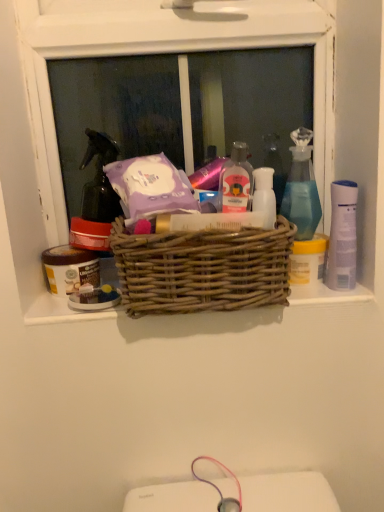
What is the approximate width of transparent glass door at upper center?

transparent glass door at upper center is 3.54 inches wide.

What is the approximate height of white plastic bottle at center, marked as the 2th toiletry in a front-to-back arrangement?

white plastic bottle at center, marked as the 2th toiletry in a front-to-back arrangement, is 9.26 centimeters tall.

Image resolution: width=384 pixels, height=512 pixels. Describe the element at coordinates (342, 236) in the screenshot. I see `white plastic mouthwash at right` at that location.

Identify the location of transparent glass door at upper center. This screenshot has width=384, height=512. (115, 111).

Considering the positions of points (143, 291) and (224, 178), is point (143, 291) closer to camera compared to point (224, 178)?

Yes.

How many degrees apart are the facing directions of woven wood basket at center and translucent plastic bottle at center, which is counted as the 3th toiletry, starting from the back?

The angular difference between woven wood basket at center and translucent plastic bottle at center, which is counted as the 3th toiletry, starting from the back, is 5.59 degrees.

Image resolution: width=384 pixels, height=512 pixels. Find the location of `picnic basket below the translucent plastic bottle at center, positioned as the second toiletry in left-to-right order (from the image's perspective)`. picnic basket below the translucent plastic bottle at center, positioned as the second toiletry in left-to-right order (from the image's perspective) is located at coordinates (202, 269).

Does woven wood basket at center have a lesser width compared to translucent plastic bottle at center, positioned as the second toiletry in left-to-right order?

No.

Which is less distant, (332, 212) or (308, 110)?

Positioned in front is point (332, 212).

From a real-world perspective, who is located higher, white plastic mouthwash at right or transparent glass door at upper center?

transparent glass door at upper center.

Is white plastic mouthwash at right far from transparent glass door at upper center?

That's right, there is a large distance between white plastic mouthwash at right and transparent glass door at upper center.

From a real-world perspective, is transparent glass door at upper center physically located above or below white plastic bottle at center, acting as the third toiletry starting from the left?

In terms of real-world spatial position, transparent glass door at upper center is above white plastic bottle at center, acting as the third toiletry starting from the left.

Identify the location of glass door above the white plastic bottle at center, acting as the third toiletry starting from the left (from the image's perspective). The height and width of the screenshot is (512, 384). (115, 111).

Is transparent glass door at upper center to the left of white plastic bottle at center, acting as the third toiletry starting from the left, from the viewer's perspective?

Yes, transparent glass door at upper center is to the left of white plastic bottle at center, acting as the third toiletry starting from the left.

Would you say white plastic bottle at center, positioned as the 2th toiletry in back-to-front order, is part of transparent glass door at upper center's contents?

No, white plastic bottle at center, positioned as the 2th toiletry in back-to-front order, is not surrounded by transparent glass door at upper center.

Would you say translucent plastic bottle at center, the first toiletry in the front-to-back sequence, is inside or outside translucent glass spray bottle at upper right?

translucent plastic bottle at center, the first toiletry in the front-to-back sequence, is not enclosed by translucent glass spray bottle at upper right.

Which of these two, translucent plastic bottle at center, which is counted as the 3th toiletry, starting from the back, or translucent glass spray bottle at upper right, is bigger?

translucent glass spray bottle at upper right is bigger.

Is translucent glass spray bottle at upper right at the back of translucent plastic bottle at center, positioned as the second toiletry in left-to-right order?

That's not correct — translucent plastic bottle at center, positioned as the second toiletry in left-to-right order, is not looking away from translucent glass spray bottle at upper right.

Is point (225, 195) positioned after point (305, 223)?

No.

Can you confirm if white plastic bottle at center, the first toiletry positioned from the right, is bigger than woven wood basket at center?

No, white plastic bottle at center, the first toiletry positioned from the right, is not bigger than woven wood basket at center.

From a real-world perspective, starting from the woven wood basket at center, which toiletry is the 1st one vertically above it? Please provide its 2D coordinates.

[(264, 195)]

How distant is white plastic bottle at center, the first toiletry positioned from the right, from woven wood basket at center?

white plastic bottle at center, the first toiletry positioned from the right, is 4.91 inches away from woven wood basket at center.

In the scene shown: How many degrees apart are the facing directions of matte brown jar at left, which is the 3th toiletry from front to back, and translucent plastic bottle at center, the first toiletry in the front-to-back sequence?

0.00737 degrees separate the facing orientations of matte brown jar at left, which is the 3th toiletry from front to back, and translucent plastic bottle at center, the first toiletry in the front-to-back sequence.

In the scene shown: From the image's perspective, relative to translucent plastic bottle at center, which is counted as the 3th toiletry, starting from the back, is matte brown jar at left, marked as the 3th toiletry in a right-to-left arrangement, above or below?

Based on their image positions, matte brown jar at left, marked as the 3th toiletry in a right-to-left arrangement, is located beneath translucent plastic bottle at center, which is counted as the 3th toiletry, starting from the back.

Is point (65, 292) farther from camera compared to point (223, 179)?

Yes.

Choose the correct answer: Is matte brown jar at left, which is the 3th toiletry from front to back, inside translucent plastic bottle at center, positioned as the second toiletry in left-to-right order, or outside it?

The correct answer is: outside.

From a real-world perspective, is woven wood basket at center positioned under white plastic mouthwash at right based on gravity?

Yes, from a real-world perspective, woven wood basket at center is beneath white plastic mouthwash at right.

Can white plastic mouthwash at right be found inside woven wood basket at center?

No, woven wood basket at center does not contain white plastic mouthwash at right.

Is woven wood basket at center wider than white plastic mouthwash at right?

Correct, the width of woven wood basket at center exceeds that of white plastic mouthwash at right.

Image resolution: width=384 pixels, height=512 pixels. What are the coordinates of `picnic basket in front of the white plastic mouthwash at right` in the screenshot? It's located at (202, 269).

Where is `picnic basket below the translucent plastic bottle at center, which appears as the 2th toiletry when viewed from the right (from a real-world perspective)`? picnic basket below the translucent plastic bottle at center, which appears as the 2th toiletry when viewed from the right (from a real-world perspective) is located at coordinates (202, 269).

The height and width of the screenshot is (512, 384). In the image, there is a white plastic mouthwash at right. Find the location of `glass door above it (from the image's perspective)`. glass door above it (from the image's perspective) is located at coordinates (115, 111).

Based on their spatial positions, is white plastic bottle at center, the first toiletry positioned from the right, or transparent glass door at upper center further from woven wood basket at center?

Among the two, transparent glass door at upper center is located further to woven wood basket at center.

Which object lies further to the anchor point white plastic bottle at center, acting as the third toiletry starting from the left, transparent glass door at upper center or translucent plastic bottle at center, positioned as the second toiletry in left-to-right order?

transparent glass door at upper center is further to white plastic bottle at center, acting as the third toiletry starting from the left.

In the scene shown: Considering their positions, is white plastic mouthwash at right positioned closer to translucent glass spray bottle at upper right than matte brown jar at left, which is the 3th toiletry from front to back?

The object closer to translucent glass spray bottle at upper right is white plastic mouthwash at right.

Looking at this image, from the image, which object appears to be nearer to translucent plastic bottle at center, the first toiletry in the front-to-back sequence, translucent glass spray bottle at upper right or woven wood basket at center?

woven wood basket at center is closer to translucent plastic bottle at center, the first toiletry in the front-to-back sequence.

Estimate the real-world distances between objects in this image. Which object is closer to transparent glass door at upper center, translucent plastic bottle at center, the first toiletry in the front-to-back sequence, or white plastic bottle at center, positioned as the 2th toiletry in back-to-front order?

translucent plastic bottle at center, the first toiletry in the front-to-back sequence.

When comparing their distances from white plastic mouthwash at right, does translucent glass spray bottle at upper right or woven wood basket at center seem closer?

Based on the image, translucent glass spray bottle at upper right appears to be nearer to white plastic mouthwash at right.

From the image, which object appears to be nearer to translucent glass spray bottle at upper right, white plastic bottle at center, the first toiletry positioned from the right, or transparent glass door at upper center?

white plastic bottle at center, the first toiletry positioned from the right, is closer to translucent glass spray bottle at upper right.

Looking at the image, which one is located further to matte brown jar at left, which is the 3th toiletry from front to back, translucent plastic bottle at center, the first toiletry in the front-to-back sequence, or translucent glass spray bottle at upper right?

translucent glass spray bottle at upper right is further to matte brown jar at left, which is the 3th toiletry from front to back.

At what (x,y) coordinates should I click in order to perform the action: click on toiletry situated between matte brown jar at left, acting as the first toiletry starting from the back, and white plastic bottle at center, acting as the third toiletry starting from the left, from left to right. Please return your answer as a coordinate pair (x, y). Looking at the image, I should click on (236, 181).

You are a GUI agent. You are given a task and a screenshot of the screen. Output one action in this format:
    pyautogui.click(x=<x>, y=<y>)
    Task: Click on the picnic basket situated between matte brown jar at left, marked as the 3th toiletry in a right-to-left arrangement, and white plastic bottle at center, the first toiletry positioned from the right, from left to right
    Image resolution: width=384 pixels, height=512 pixels.
    Given the screenshot: What is the action you would take?
    pyautogui.click(x=202, y=269)

Where is `cleaning product between transparent glass door at upper center and woven wood basket at center vertically`? This screenshot has width=384, height=512. cleaning product between transparent glass door at upper center and woven wood basket at center vertically is located at coordinates click(302, 188).

Identify the location of cleaning product between white plastic bottle at center, the first toiletry positioned from the right, and white plastic mouthwash at right from left to right. Image resolution: width=384 pixels, height=512 pixels. (302, 188).